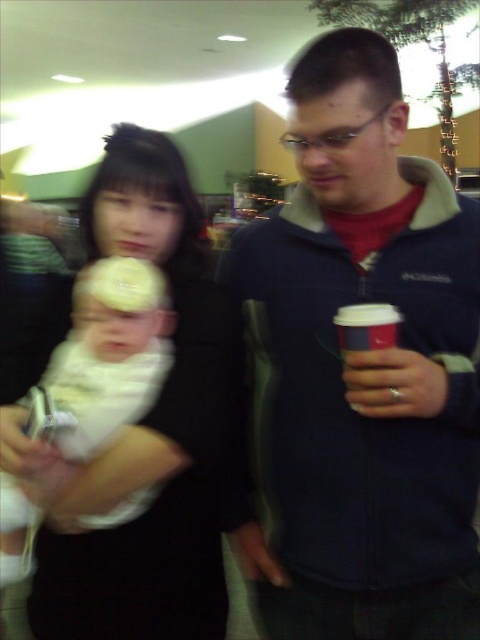
Is blue fleece jacket at center to the right of white matte baby at center from the viewer's perspective?

Yes, blue fleece jacket at center is to the right of white matte baby at center.

Who is higher up, blue fleece jacket at center or white matte baby at center?

blue fleece jacket at center

Identify the location of blue fleece jacket at center. (360, 371).

Locate an element on the screen. The width and height of the screenshot is (480, 640). blue fleece jacket at center is located at coordinates (360, 371).

Consider the image. Is blue fleece jacket at center to the left of white paper cup at right from the viewer's perspective?

Indeed, blue fleece jacket at center is positioned on the left side of white paper cup at right.

Which is more to the left, blue fleece jacket at center or white paper cup at right?

Positioned to the left is blue fleece jacket at center.

Is point (434, 314) farther from viewer compared to point (362, 320)?

Yes, point (434, 314) is farther from viewer.

This screenshot has width=480, height=640. Find the location of `blue fleece jacket at center`. blue fleece jacket at center is located at coordinates (360, 371).

Is white matte baby at center wider than white soft fabric baby at left?

Indeed, white matte baby at center has a greater width compared to white soft fabric baby at left.

Does white matte baby at center lie in front of white soft fabric baby at left?

Yes, it is in front of white soft fabric baby at left.

What are the coordinates of `white matte baby at center` in the screenshot? It's located at (149, 432).